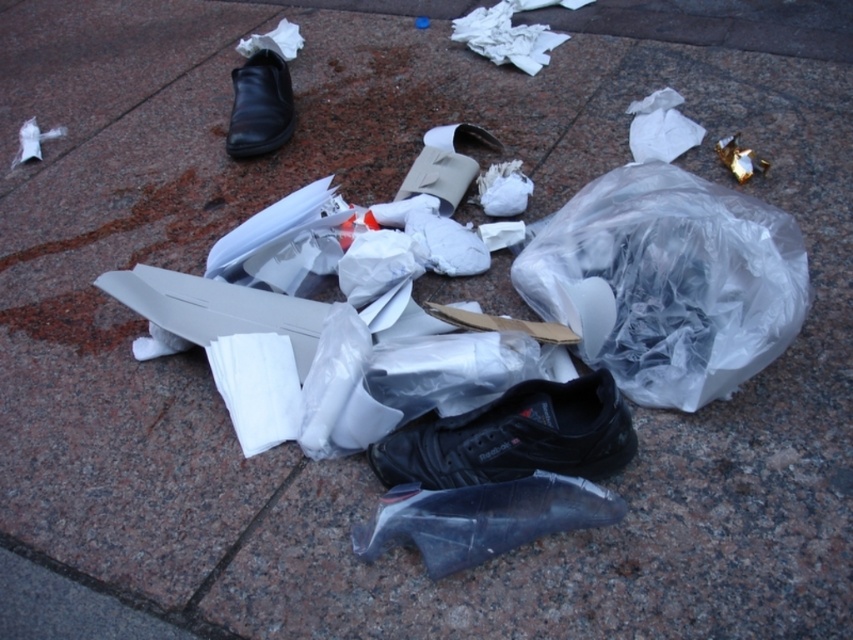
You are standing at the point labeled point (276,84) and want to walk to the point labeled point (548,294). Which direction should you face to walk towards your destination?

You should face forward because point (548,294) is in front of point (276,84).

You are a janitor who needs to collect all items in the scene. Starting from the black matte shoe at center, which direction should you move to first to reach the transparent plastic shoe at center?

The transparent plastic shoe at center is to the left of the black matte shoe at center, so you should move to the left to reach it first.